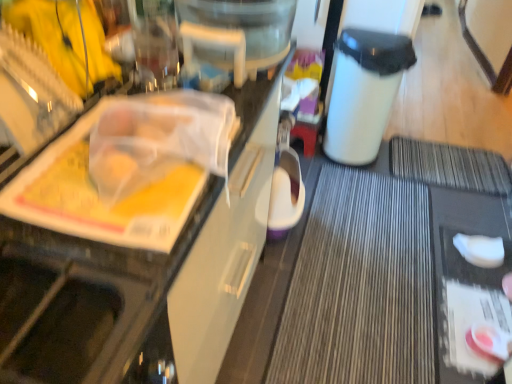
Question: Is white plastic tray at upper left inside the boundaries of pink glossy jar at lower right, which appears as the first food when ordered from the bottom, or outside?

Choices:
 (A) outside
 (B) inside

Answer: (A)

Question: From a real-world perspective, is white plastic tray at upper left positioned above or below pink glossy jar at lower right, which is the second food from back to front?

Choices:
 (A) above
 (B) below

Answer: (A)

Question: Considering the real-world distances, which object is closest to the white matte sponge at lower right, which appears as the first food when viewed from the back?

Choices:
 (A) pink glossy jar at lower right, which appears as the first food when ordered from the bottom
 (B) white plastic trash bin at center-right
 (C) white plastic tray at upper left

Answer: (A)

Question: Considering the real-world distances, which object is closest to the white plastic tray at upper left?

Choices:
 (A) white plastic trash bin at center-right
 (B) pink glossy jar at lower right, the second food in the top-to-bottom sequence
 (C) white matte sponge at lower right, arranged as the second food when viewed from the front

Answer: (A)